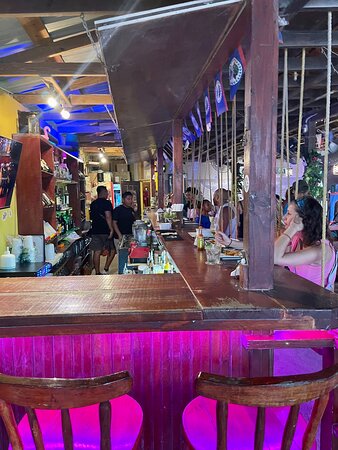
Locate an element on the screen. lightbulbs is located at coordinates (52, 102), (64, 115), (102, 160), (101, 154).